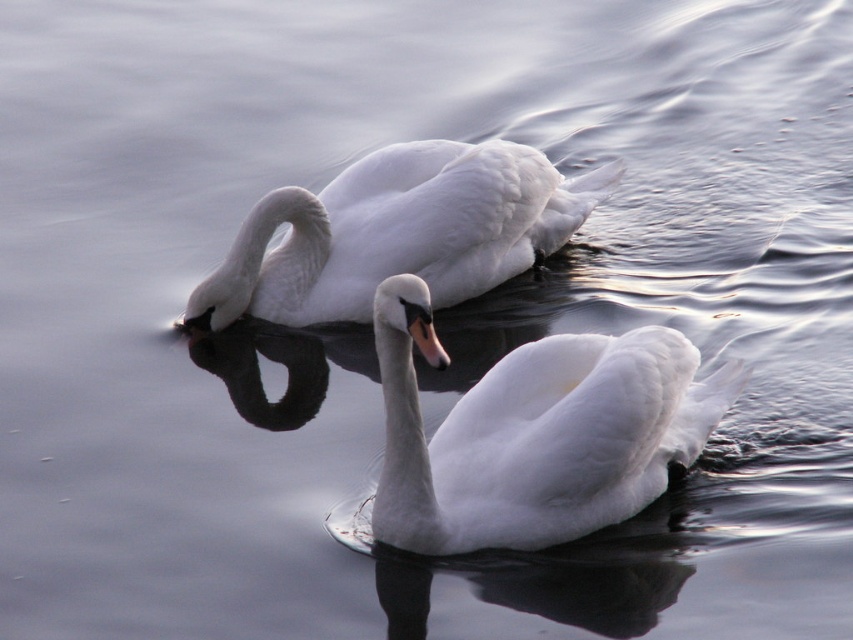
Can you confirm if white glossy swan at center is wider than white glossy swan at upper center?

No.

Measure the distance between point [671,396] and camera.

Point [671,396] and camera are 4.94 meters apart from each other.

Does point (714, 378) come in front of point (422, 211)?

Yes, it is.

Locate an element on the screen. Image resolution: width=853 pixels, height=640 pixels. white glossy swan at center is located at coordinates (534, 433).